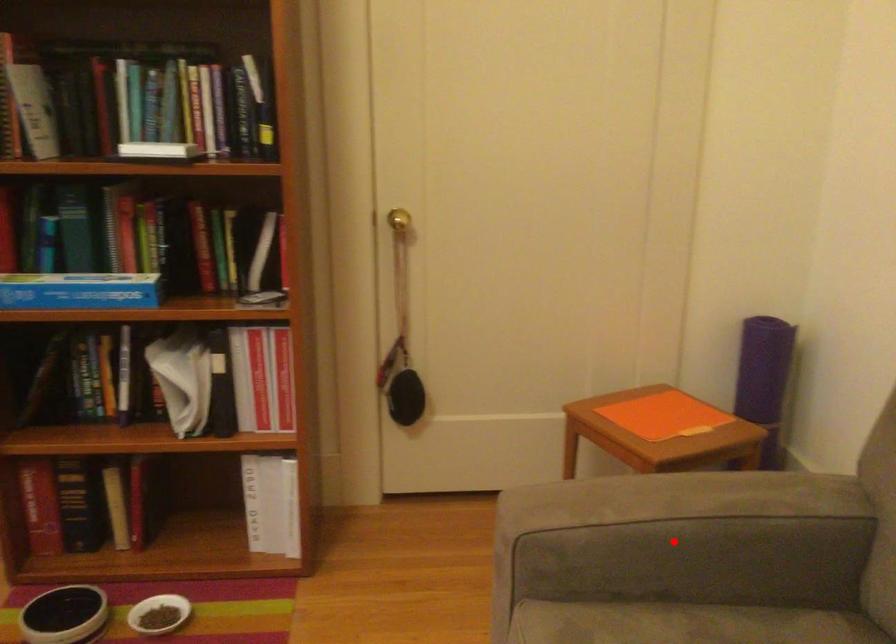
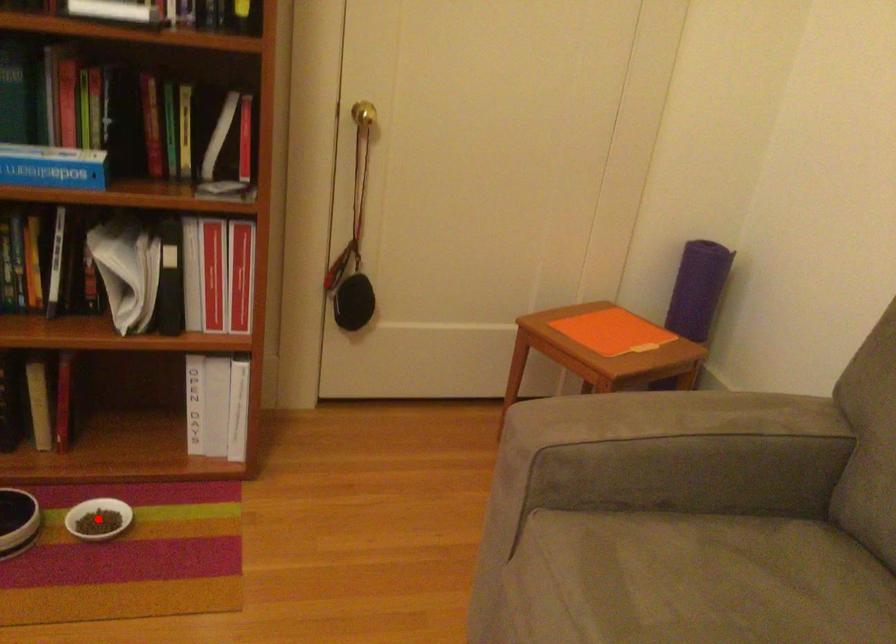
I am providing you with two images of the same scene from different viewpoints. A red point is marked on the first image and another point is marked on the second image. Is the red point in image1 aligned with the point shown in image2?

No